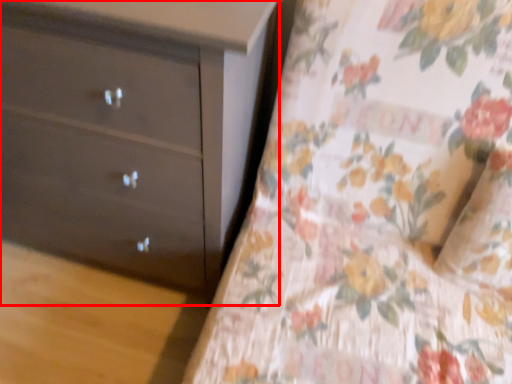
Question: From the image's perspective, where is chest of drawers (annotated by the red box) located in relation to sheet in the image?

Choices:
 (A) above
 (B) below

Answer: (A)